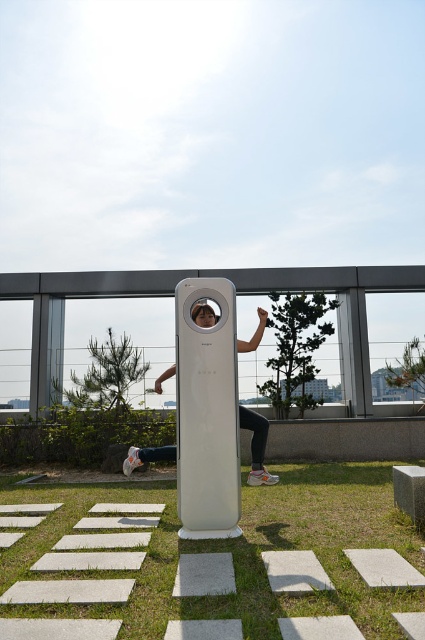
Question: Is green grass at lower center above matte white pole at center?

Choices:
 (A) no
 (B) yes

Answer: (A)

Question: Which point is closer to the camera?

Choices:
 (A) green grass at lower center
 (B) matte white pole at center

Answer: (A)

Question: Which point is closer to the camera?

Choices:
 (A) matte white pole at center
 (B) green grass at lower center

Answer: (B)

Question: Where is green grass at lower center located in relation to matte white pole at center in the image?

Choices:
 (A) below
 (B) above

Answer: (A)

Question: Is green grass at lower center thinner than matte white pole at center?

Choices:
 (A) yes
 (B) no

Answer: (B)